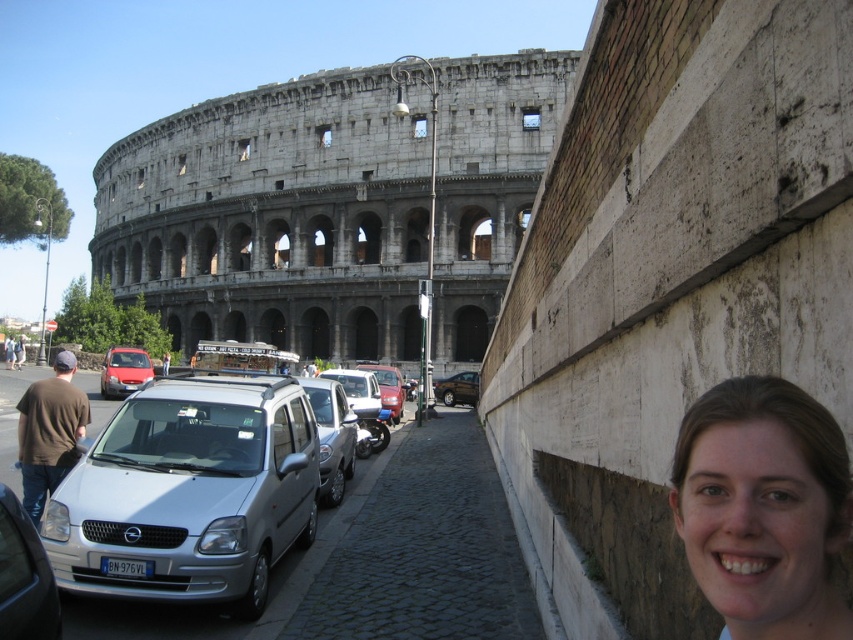
You are standing at the point marked as point (276, 216) in the image. What is the closest major landmark visible from this point?

The closest major landmark visible from point (276, 216) is the gray stone amphitheater at upper left.

You are a tour guide leading a group near the Colosseum. You need to load some equipment into the vehicles. Which vehicle, the silver metallic van at center or the matte red car at center, can accommodate taller equipment?

The silver metallic van at center has a greater height compared to the matte red car at center, so it can accommodate taller equipment.